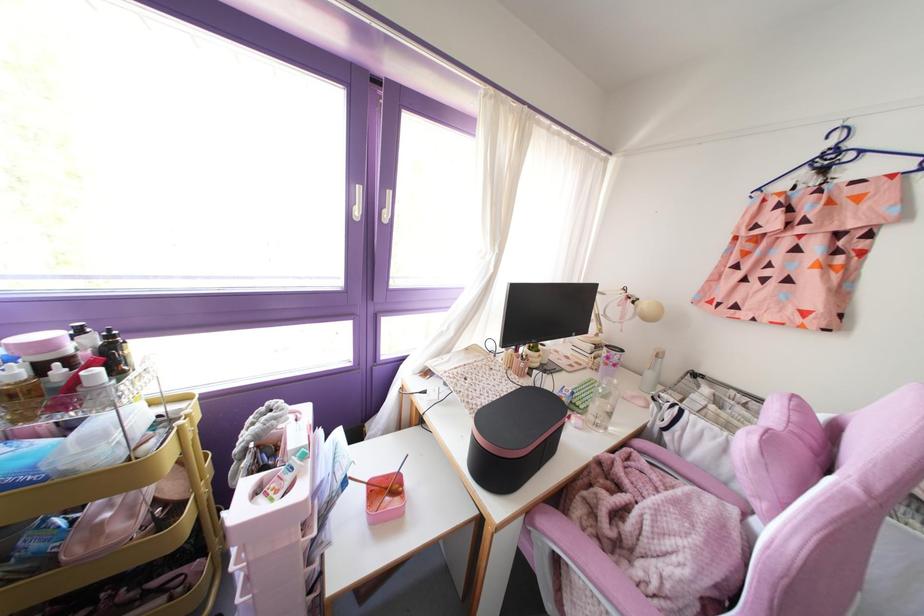
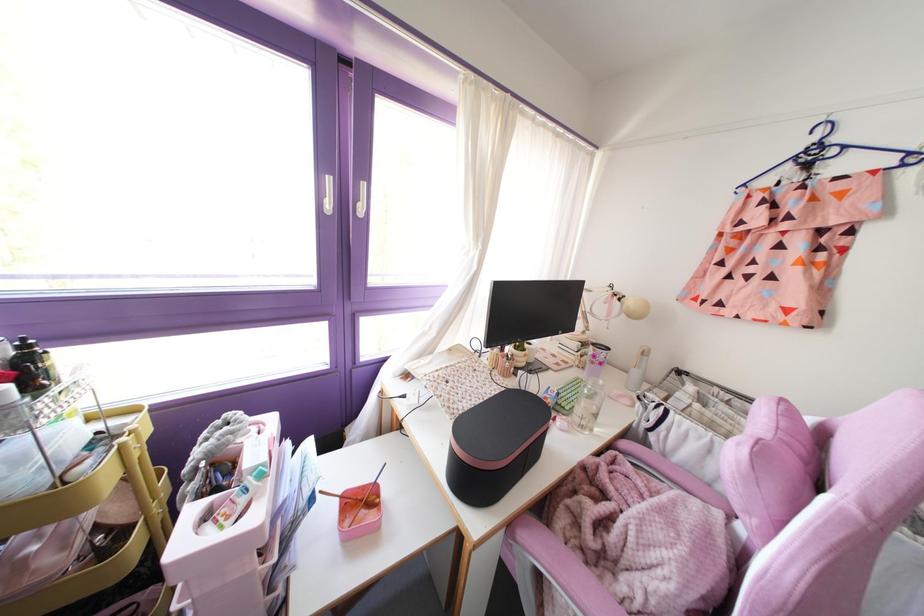
The point at (185, 398) is marked in the first image. Where is the corresponding point in the second image?

(130, 411)